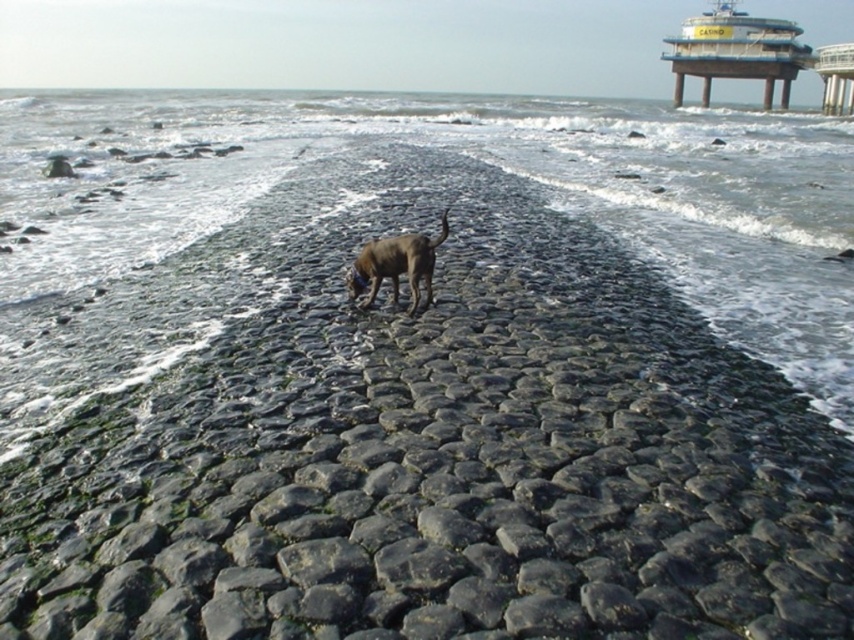
From the picture: Who is higher up, clear water at center or metallic gray pier at upper right?

metallic gray pier at upper right is higher up.

Which of these two, clear water at center or metallic gray pier at upper right, stands shorter?

With less height is metallic gray pier at upper right.

Between point (313, 150) and point (839, 108), which one is positioned in front?

Point (313, 150) is in front.

Image resolution: width=854 pixels, height=640 pixels. What are the coordinates of `clear water at center` in the screenshot? It's located at (383, 196).

Between metallic blue dock at upper right and brown matte dog at center, which one is positioned lower?

brown matte dog at center

From the picture: Does metallic blue dock at upper right appear under brown matte dog at center?

Incorrect, metallic blue dock at upper right is not positioned below brown matte dog at center.

This screenshot has height=640, width=854. In order to click on metallic blue dock at upper right in this screenshot , I will do `click(736, 51)`.

Is clear water at center to the right of metallic blue dock at upper right from the viewer's perspective?

No, clear water at center is not to the right of metallic blue dock at upper right.

Does clear water at center have a lesser height compared to metallic blue dock at upper right?

Incorrect, clear water at center's height does not fall short of metallic blue dock at upper right's.

Is point (847, 198) positioned in front of point (682, 42)?

Yes.

You are a GUI agent. You are given a task and a screenshot of the screen. Output one action in this format:
    pyautogui.click(x=<x>, y=<y>)
    Task: Click on the clear water at center
    The width and height of the screenshot is (854, 640).
    Given the screenshot: What is the action you would take?
    pyautogui.click(x=383, y=196)